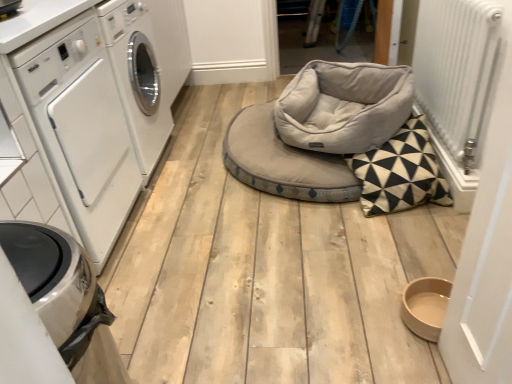
Question: Based on their positions, is light gray plush bean bag chair at center located to the left or right of white glossy washing machine at left?

Choices:
 (A) right
 (B) left

Answer: (A)

Question: Looking at the image, does light gray plush bean bag chair at center seem bigger or smaller compared to white glossy washing machine at left?

Choices:
 (A) small
 (B) big

Answer: (A)

Question: Considering the real-world distances, which object is closest to the white metallic radiator at right?

Choices:
 (A) white glossy washing machine at left
 (B) light gray plush bean bag chair at center
 (C) soft gray fabric daybed at center
 (D) satin silver trash bin at lower left

Answer: (B)

Question: Which of these objects is positioned farthest from the white metallic radiator at right?

Choices:
 (A) white glossy washing machine at left
 (B) satin silver trash bin at lower left
 (C) light gray plush bean bag chair at center
 (D) soft gray fabric daybed at center

Answer: (B)